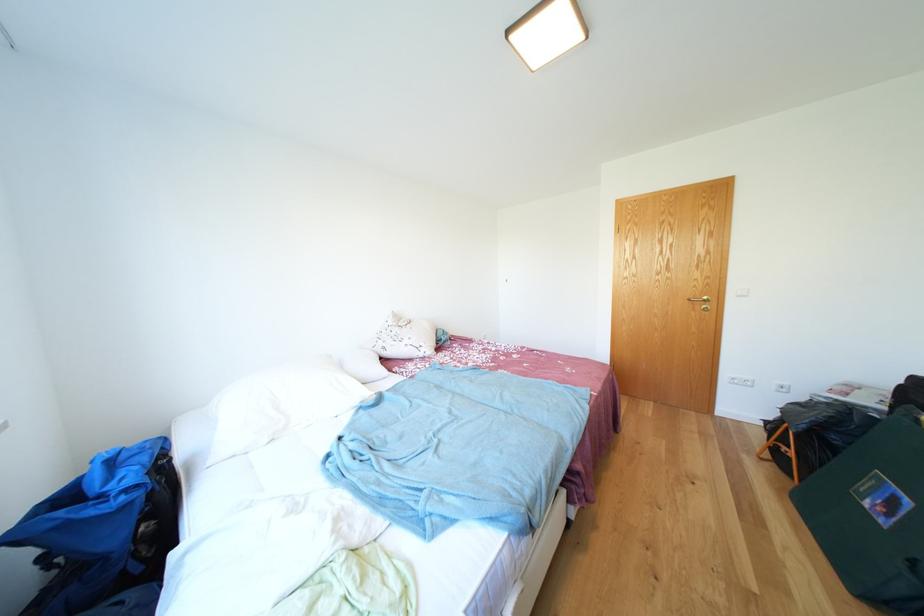
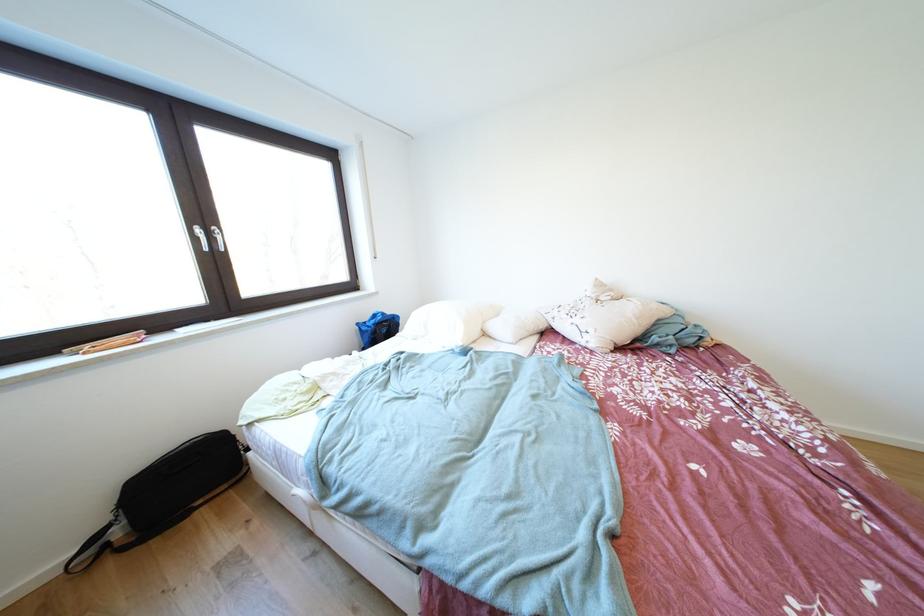
Where in the second image is the point corresponding to pixel 175 444 from the first image?

(407, 321)